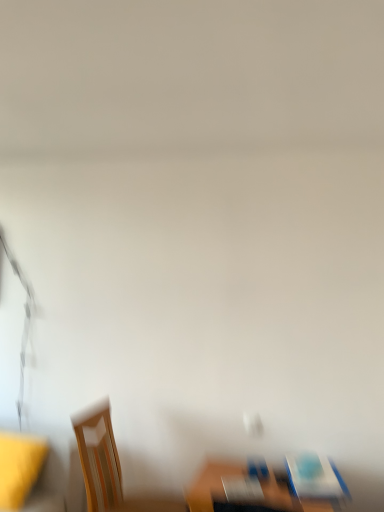
Question: Can you confirm if yellow fabric at left is smaller than wooden chair at lower left, marked as the 2th chair in a right-to-left arrangement?

Choices:
 (A) yes
 (B) no

Answer: (A)

Question: Considering the relative sizes of yellow fabric at left and wooden chair at lower left, arranged as the first chair when viewed from the left, in the image provided, is yellow fabric at left shorter than wooden chair at lower left, arranged as the first chair when viewed from the left,?

Choices:
 (A) no
 (B) yes

Answer: (B)

Question: From the image's perspective, is yellow fabric at left beneath wooden chair at lower left, the first chair when ordered from bottom to top?

Choices:
 (A) yes
 (B) no

Answer: (A)

Question: From a real-world perspective, is yellow fabric at left positioned over wooden chair at lower left, the first chair when ordered from bottom to top, based on gravity?

Choices:
 (A) no
 (B) yes

Answer: (A)

Question: Does yellow fabric at left have a greater width compared to wooden chair at lower left, which ranks as the 2th chair in top-to-bottom order?

Choices:
 (A) no
 (B) yes

Answer: (A)

Question: Considering the relative sizes of yellow fabric at left and wooden chair at lower left, which ranks as the 2th chair in top-to-bottom order, in the image provided, is yellow fabric at left thinner than wooden chair at lower left, which ranks as the 2th chair in top-to-bottom order,?

Choices:
 (A) no
 (B) yes

Answer: (B)

Question: Is wooden table at lower center smaller than matte wood chair at lower right, acting as the 1th chair starting from the top?

Choices:
 (A) no
 (B) yes

Answer: (A)

Question: Is wooden table at lower center outside matte wood chair at lower right, acting as the 1th chair starting from the top?

Choices:
 (A) no
 (B) yes

Answer: (B)

Question: Is there a large distance between wooden table at lower center and matte wood chair at lower right, which is the 2th chair from left to right?

Choices:
 (A) yes
 (B) no

Answer: (B)

Question: Does wooden table at lower center turn towards matte wood chair at lower right, acting as the 1th chair starting from the top?

Choices:
 (A) no
 (B) yes

Answer: (A)

Question: Does wooden table at lower center have a lesser height compared to matte wood chair at lower right, acting as the 1th chair starting from the top?

Choices:
 (A) no
 (B) yes

Answer: (A)

Question: Is wooden table at lower center touching matte wood chair at lower right, which is the second chair from bottom to top?

Choices:
 (A) no
 (B) yes

Answer: (B)

Question: Is wooden table at lower center smaller than yellow fabric at left?

Choices:
 (A) yes
 (B) no

Answer: (B)